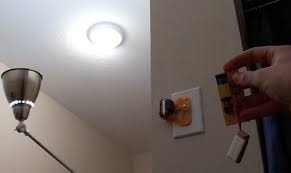
You are a GUI agent. You are given a task and a screenshot of the screen. Output one action in this format:
    pyautogui.click(x=<x>, y=<y>)
    Task: Click on the ceiling light
    
    Given the screenshot: What is the action you would take?
    pyautogui.click(x=102, y=36)